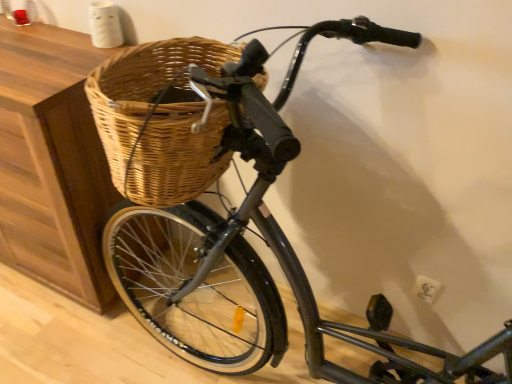
Question: Should I look upward or downward to see wooden cabinet at left?

Choices:
 (A) down
 (B) up

Answer: (B)